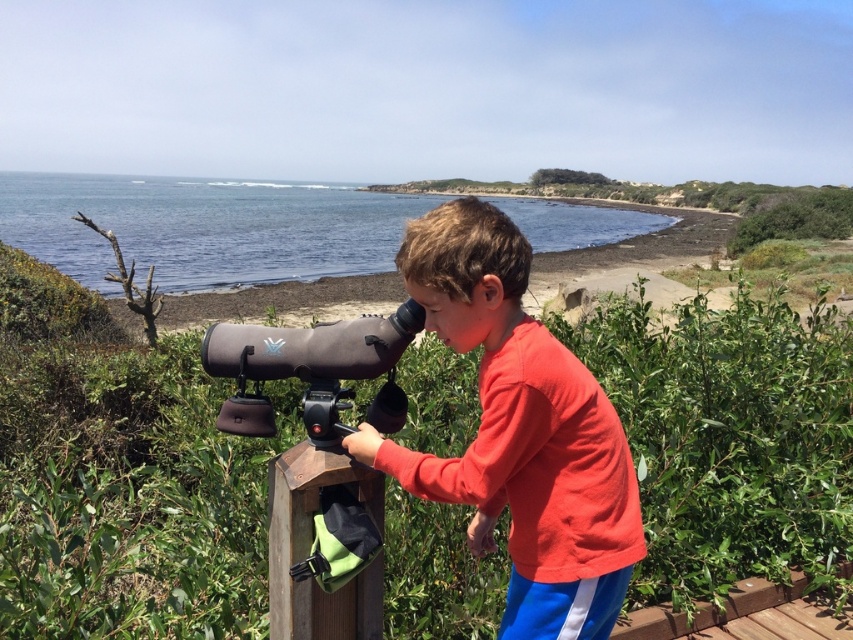
Can you confirm if matte red shirt at center is bigger than matte black telescope at center?

Yes, matte red shirt at center is bigger than matte black telescope at center.

Is matte red shirt at center positioned in front of matte black telescope at center?

Yes.

Who is more forward, (x=425, y=260) or (x=212, y=353)?

Positioned in front is point (x=425, y=260).

The image size is (853, 640). Identify the location of matte red shirt at center. (519, 433).